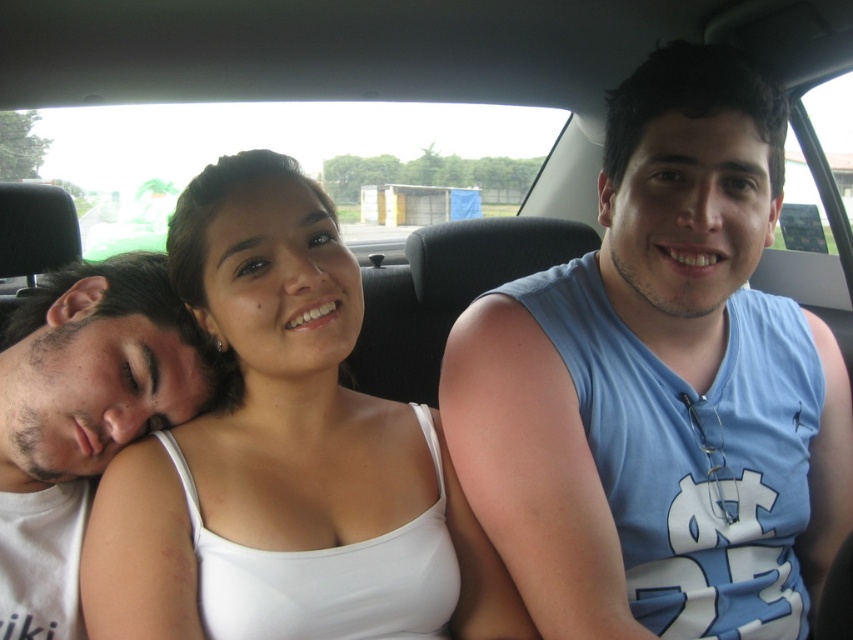
Question: Which of the following is the closest to the observer?

Choices:
 (A) white cotton shirt at left
 (B) white matte tank top at center
 (C) blue sleeveless shirt at upper right

Answer: (B)

Question: Can you confirm if blue sleeveless shirt at upper right is positioned to the left of white matte tank top at center?

Choices:
 (A) no
 (B) yes

Answer: (A)

Question: Considering the relative positions of blue sleeveless shirt at upper right and white cotton shirt at left in the image provided, where is blue sleeveless shirt at upper right located with respect to white cotton shirt at left?

Choices:
 (A) above
 (B) below

Answer: (A)

Question: Can you confirm if blue sleeveless shirt at upper right is wider than white cotton shirt at left?

Choices:
 (A) yes
 (B) no

Answer: (A)

Question: Which object is the farthest from the white cotton shirt at left?

Choices:
 (A) blue sleeveless shirt at upper right
 (B) white matte tank top at center

Answer: (A)

Question: Based on their relative distances, which object is farther from the white cotton shirt at left?

Choices:
 (A) white matte tank top at center
 (B) blue sleeveless shirt at upper right

Answer: (B)